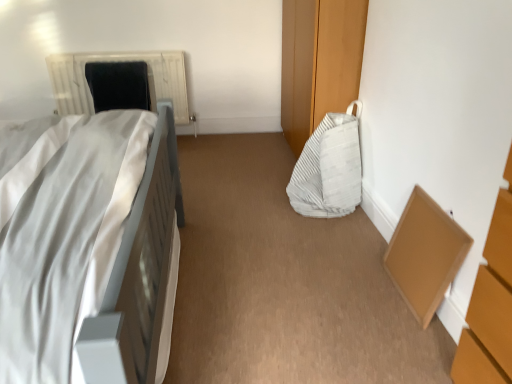
Question: Is brown cardboard box at lower right further to the viewer compared to white matte bed at left?

Choices:
 (A) no
 (B) yes

Answer: (B)

Question: Does brown cardboard box at lower right have a larger size compared to white matte bed at left?

Choices:
 (A) no
 (B) yes

Answer: (A)

Question: From a real-world perspective, is brown cardboard box at lower right located higher than white matte bed at left?

Choices:
 (A) yes
 (B) no

Answer: (B)

Question: Could white matte bed at left be considered to be inside brown cardboard box at lower right?

Choices:
 (A) yes
 (B) no

Answer: (B)

Question: Is brown cardboard box at lower right beside white matte bed at left?

Choices:
 (A) no
 (B) yes

Answer: (A)

Question: Considering the relative sizes of brown cardboard box at lower right and white matte bed at left in the image provided, is brown cardboard box at lower right smaller than white matte bed at left?

Choices:
 (A) no
 (B) yes

Answer: (B)

Question: Is brown cardboard box at lower right touching white textured radiator at upper left?

Choices:
 (A) no
 (B) yes

Answer: (A)

Question: Is the depth of brown cardboard box at lower right greater than that of white textured radiator at upper left?

Choices:
 (A) yes
 (B) no

Answer: (B)

Question: Is there a large distance between brown cardboard box at lower right and white textured radiator at upper left?

Choices:
 (A) no
 (B) yes

Answer: (B)

Question: From a real-world perspective, is brown cardboard box at lower right over white textured radiator at upper left?

Choices:
 (A) no
 (B) yes

Answer: (A)

Question: From the image's perspective, does brown cardboard box at lower right appear lower than white textured radiator at upper left?

Choices:
 (A) yes
 (B) no

Answer: (A)

Question: Is brown cardboard box at lower right oriented away from white textured radiator at upper left?

Choices:
 (A) no
 (B) yes

Answer: (A)

Question: Considering the relative positions of black fabric bean bag at upper left, which appears as the 1th bean bag chair when viewed from the back, and white textured radiator at upper left in the image provided, is black fabric bean bag at upper left, which appears as the 1th bean bag chair when viewed from the back, to the left of white textured radiator at upper left from the viewer's perspective?

Choices:
 (A) no
 (B) yes

Answer: (A)